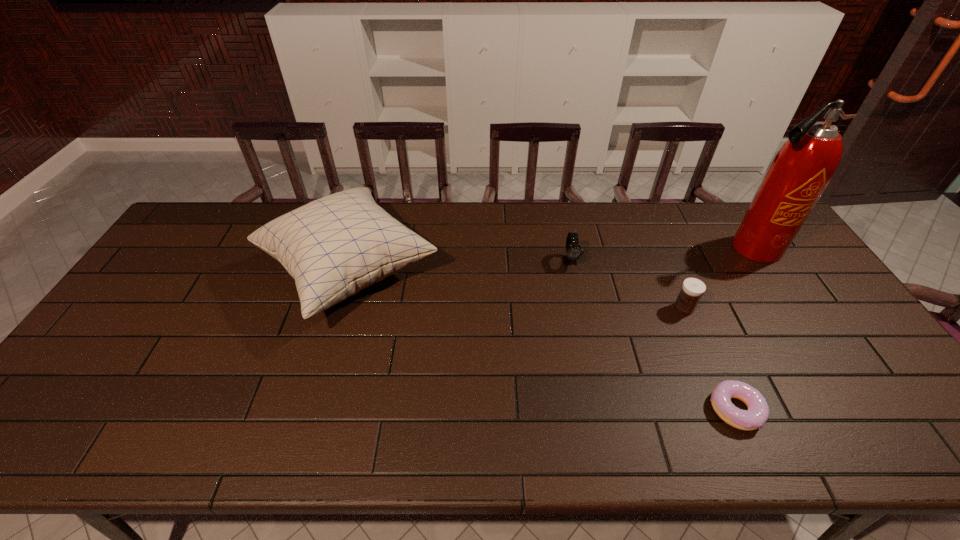
Locate an element on the screen. The height and width of the screenshot is (540, 960). vacant space at the right edge is located at coordinates (864, 346).

In the image, there is a desktop. At what (x,y) coordinates should I click in order to perform the action: click on vacant space at the far left corner. Please return your answer as a coordinate pair (x, y). The height and width of the screenshot is (540, 960). Looking at the image, I should click on (188, 224).

I want to click on vacant space at the near right corner of the desktop, so click(925, 423).

At what (x,y) coordinates should I click in order to perform the action: click on free point between the rightmost object and the fourth shortest object. Please return your answer as a coordinate pair (x, y). This screenshot has height=540, width=960. Looking at the image, I should click on (551, 260).

Where is `unoccupied area between the shortest object and the medicine`? This screenshot has height=540, width=960. unoccupied area between the shortest object and the medicine is located at coordinates (709, 359).

The height and width of the screenshot is (540, 960). Find the location of `free space between the second object from left to right and the shortest object`. free space between the second object from left to right and the shortest object is located at coordinates (653, 335).

Find the location of a particular element. The height and width of the screenshot is (540, 960). vacant space that is in between the fire extinguisher and the medicine is located at coordinates (718, 278).

Identify the location of empty location between the medicine and the cushion. (516, 290).

Locate an element on the screen. empty location between the shortest object and the cushion is located at coordinates (542, 340).

Where is `blank region between the doughnut and the fire extinguisher`? The image size is (960, 540). blank region between the doughnut and the fire extinguisher is located at coordinates (744, 329).